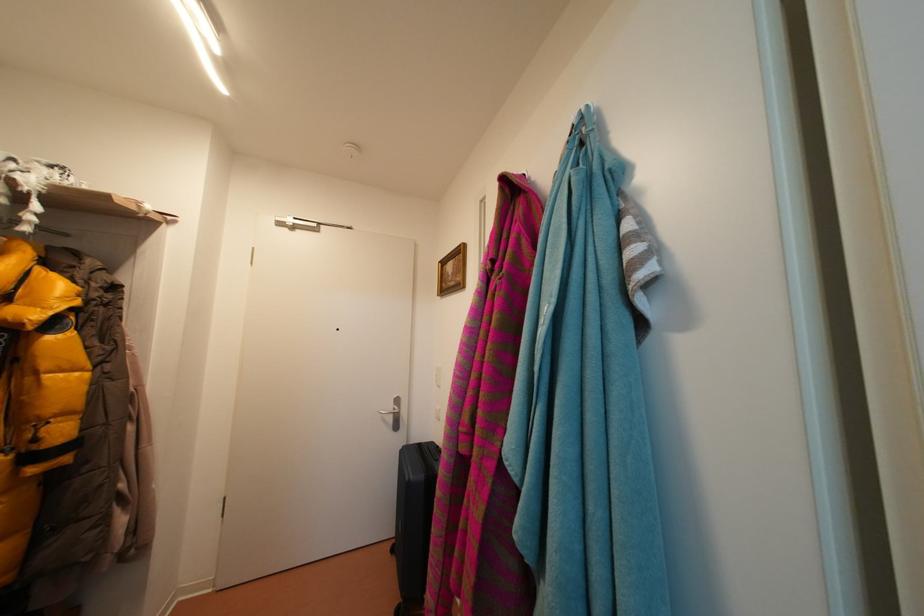
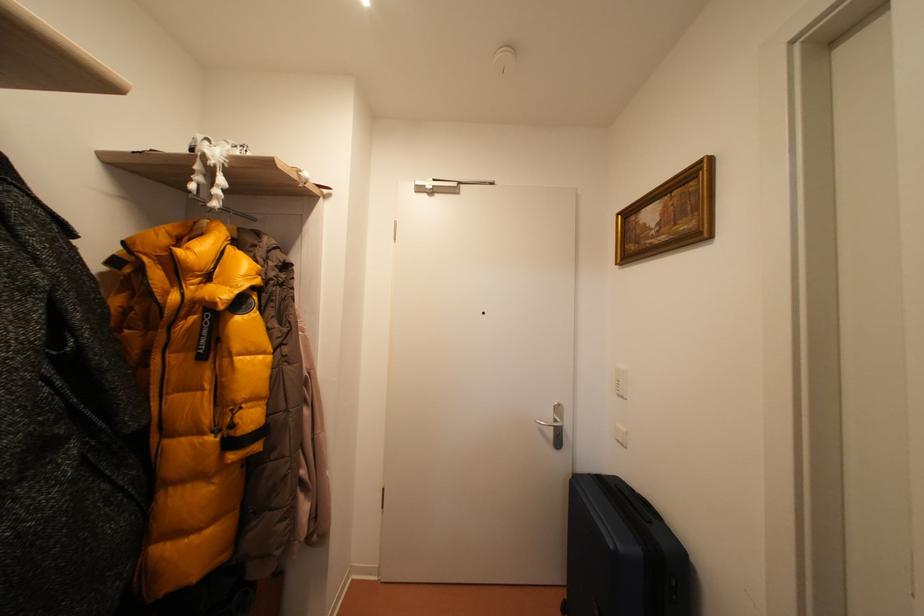
Question: The camera is either moving clockwise (left) or counter-clockwise (right) around the object. The first image is from the beginning of the video and the second image is from the end. Is the camera moving left or right when shooting the video?

Choices:
 (A) Left
 (B) Right

Answer: (B)